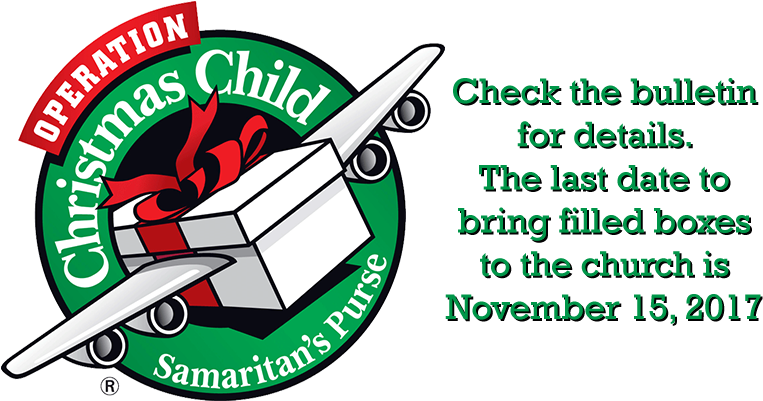
You are a GUI agent. You are given a task and a screenshot of the screen. Output one action in this format:
    pyautogui.click(x=<x>, y=<y>)
    Task: Click on the lid of box
    Image resolution: width=763 pixels, height=401 pixels.
    Given the screenshot: What is the action you would take?
    pyautogui.click(x=287, y=189)